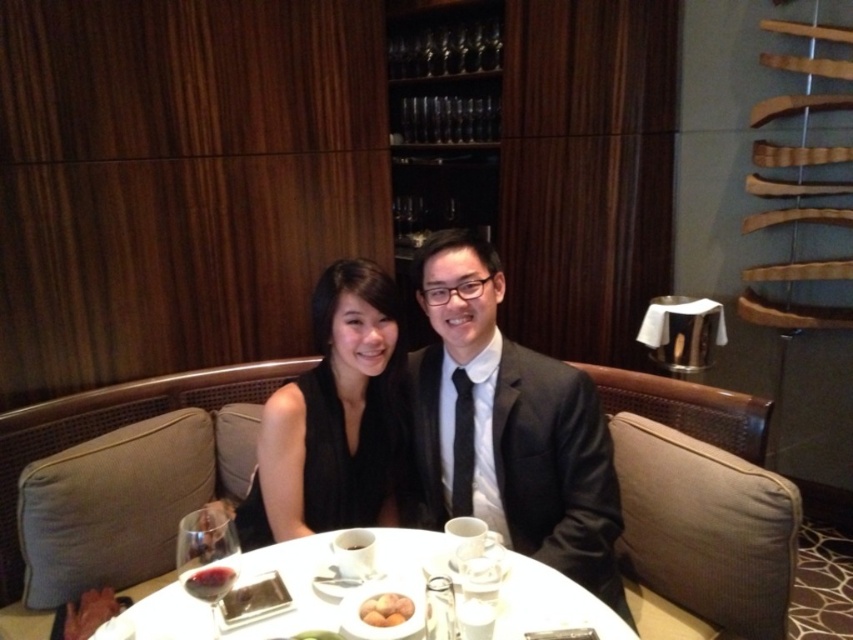
Question: Does matte black suit at center appear over smooth yellow eggs at table center?

Choices:
 (A) yes
 (B) no

Answer: (A)

Question: Which point is closer to the camera taking this photo?

Choices:
 (A) (323, 442)
 (B) (575, 544)

Answer: (B)

Question: Can you confirm if matte black suit at center is positioned above black satin dress at center?

Choices:
 (A) no
 (B) yes

Answer: (A)

Question: Is matte black suit at center thinner than black satin dress at center?

Choices:
 (A) no
 (B) yes

Answer: (A)

Question: Which point is farther to the camera?

Choices:
 (A) matte black suit at center
 (B) white glossy table at center

Answer: (A)

Question: Based on their relative distances, which object is nearer to the matte black suit at center?

Choices:
 (A) smooth yellow eggs at table center
 (B) white glossy table at center

Answer: (B)